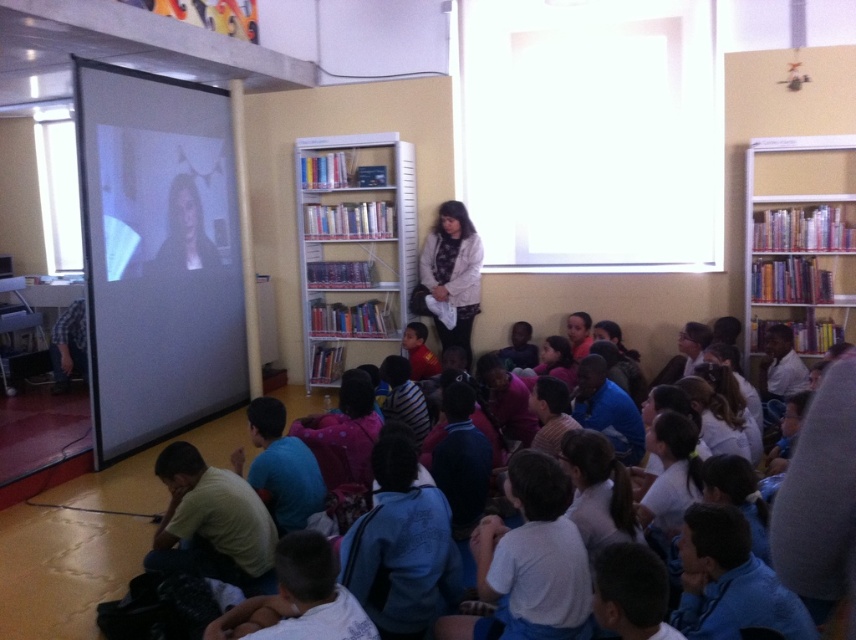
What do you see at coordinates (450, 273) in the screenshot? The width and height of the screenshot is (856, 640). I see `white fabric at center` at bounding box center [450, 273].

Looking at this image, which of these two, white fabric at center or matte red shirt at center, stands taller?

white fabric at center is taller.

Image resolution: width=856 pixels, height=640 pixels. What do you see at coordinates (450, 273) in the screenshot?
I see `white fabric at center` at bounding box center [450, 273].

Image resolution: width=856 pixels, height=640 pixels. I want to click on white fabric at center, so click(450, 273).

Is white plastic bookcase at upper right positioned before white fabric at center?

Yes, it is.

At what (x,y) coordinates should I click in order to perform the action: click on white plastic bookcase at upper right. Please return your answer as a coordinate pair (x, y). Looking at the image, I should click on (800, 243).

Locate an element on the screen. white plastic bookcase at upper right is located at coordinates (800, 243).

Who is higher up, white plastic bookcase at upper right or matte red shirt at center?

white plastic bookcase at upper right is above.

Who is taller, white plastic bookcase at upper right or matte red shirt at center?

With more height is white plastic bookcase at upper right.

Measure the distance between point (x=841, y=298) and camera.

They are 5.15 meters apart.

You are a GUI agent. You are given a task and a screenshot of the screen. Output one action in this format:
    pyautogui.click(x=<x>, y=<y>)
    Task: Click on the white plastic bookcase at upper right
    The height and width of the screenshot is (640, 856).
    Given the screenshot: What is the action you would take?
    pyautogui.click(x=800, y=243)